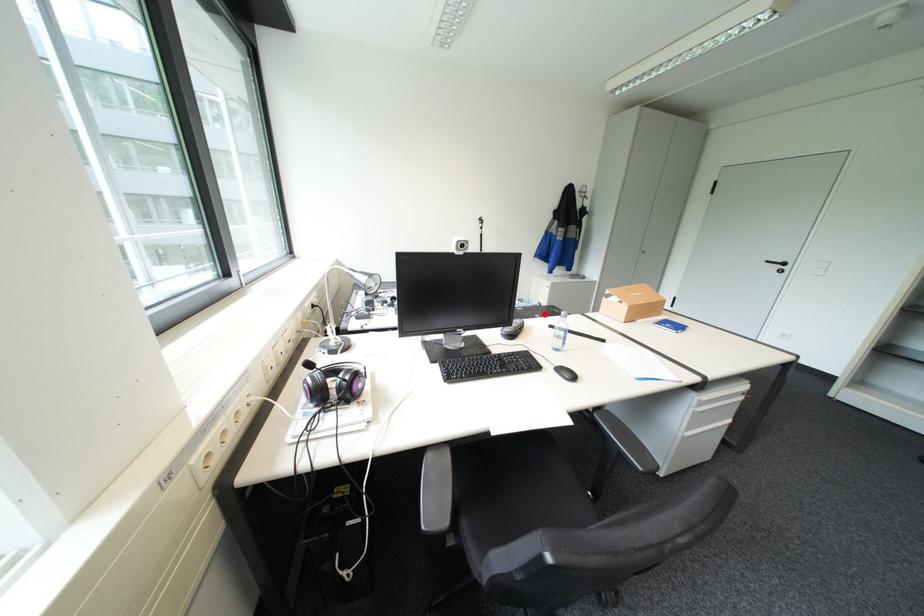
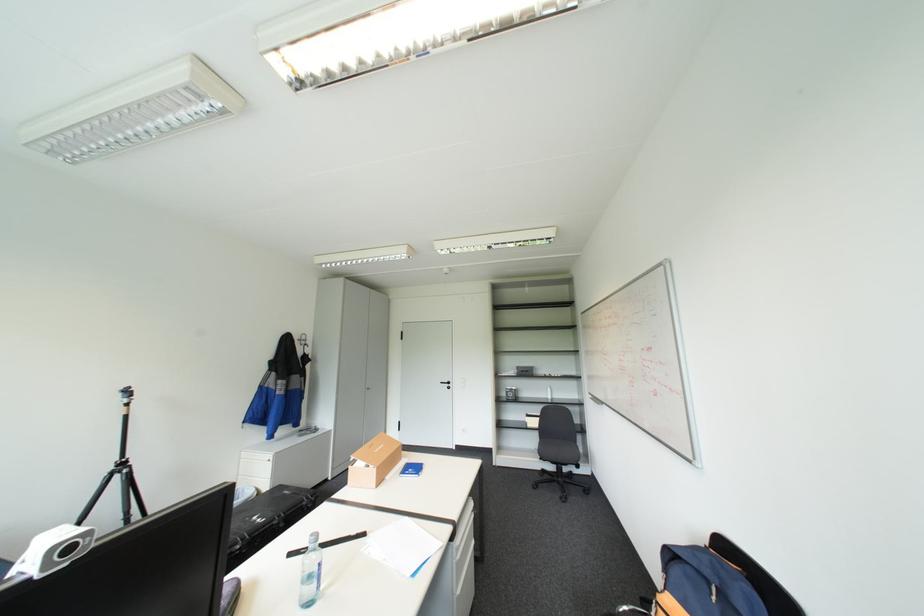
Question: I am providing you with two images of the same scene from different viewpoints. A red point is shown in image1. For the corresponding object point in image2, is it positioned nearer or farther from the camera?

Choices:
 (A) Nearer
 (B) Farther

Answer: (A)